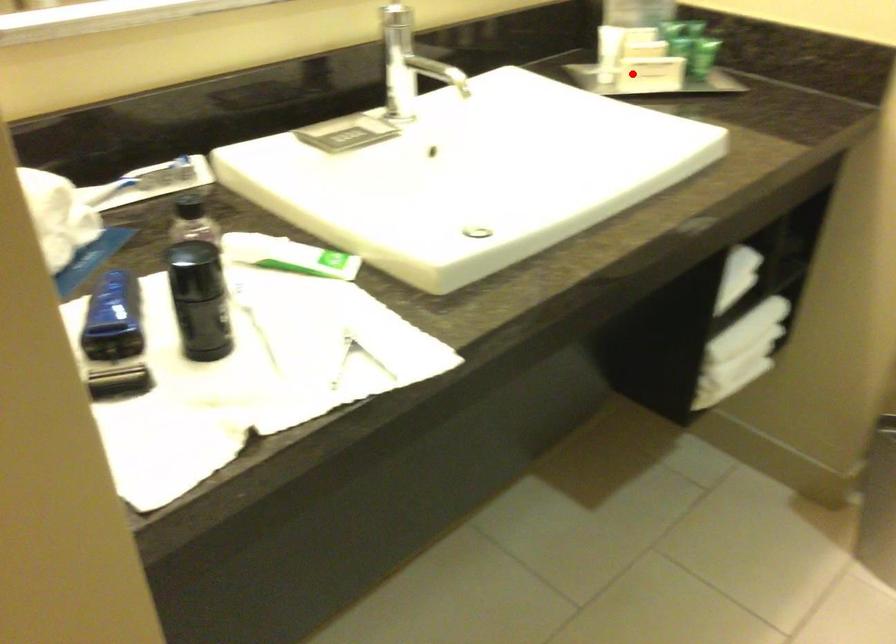
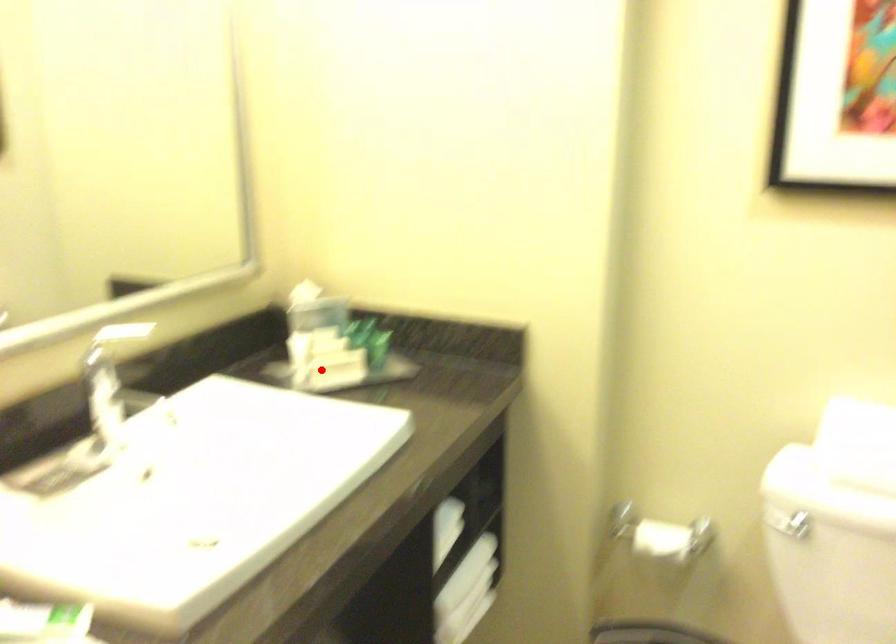
I am providing you with two images of the same scene from different viewpoints. A red point is marked on the first image and another point is marked on the second image. Is the marked point in image1 the same physical position as the marked point in image2?

Yes